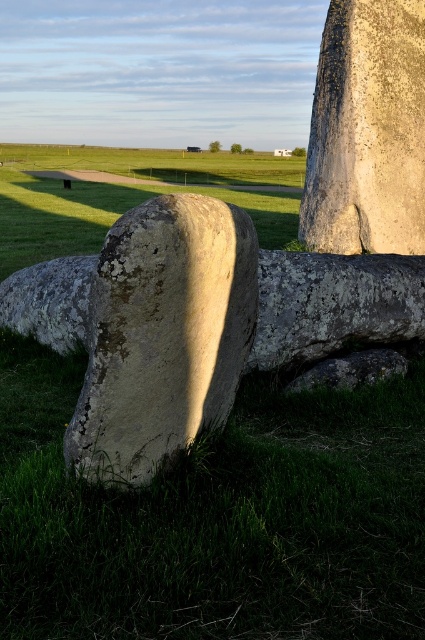
Can you confirm if rough stone boulder at center is shorter than speckled stone boulder at center?

Correct, rough stone boulder at center is not as tall as speckled stone boulder at center.

Find the location of a particular element. The height and width of the screenshot is (640, 425). rough stone boulder at center is located at coordinates (163, 333).

Who is more forward, (214,342) or (362,122)?

Point (214,342) is in front.

At what (x,y) coordinates should I click in order to perform the action: click on rough stone boulder at center. Please return your answer as a coordinate pair (x, y). The width and height of the screenshot is (425, 640). Looking at the image, I should click on (163, 333).